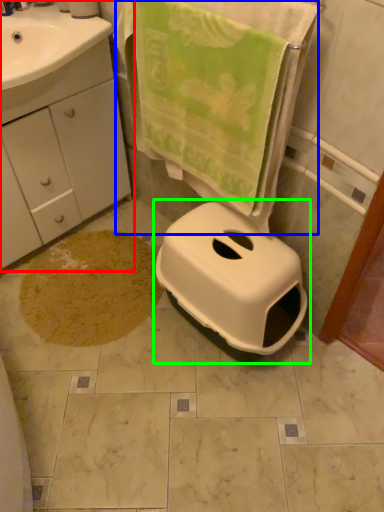
Question: Estimate the real-world distances between objects in this image. Which object is farther from bathroom cabinet (highlighted by a red box), beach towel (highlighted by a blue box) or toilet (highlighted by a green box)?

Choices:
 (A) beach towel
 (B) toilet

Answer: (B)